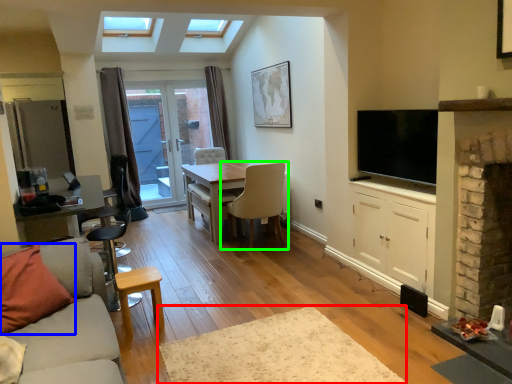
Question: Estimate the real-world distances between objects in this image. Which object is farther from plain (highlighted by a red box), pillow (highlighted by a blue box) or chair (highlighted by a green box)?

Choices:
 (A) pillow
 (B) chair

Answer: (B)